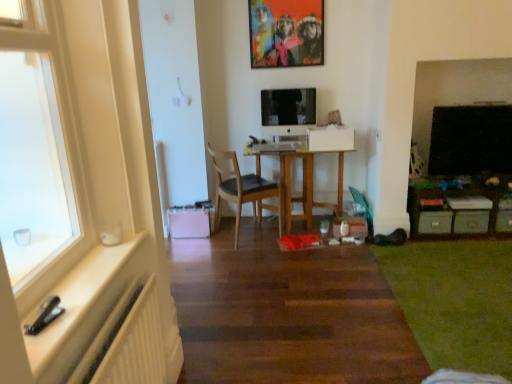
Find the location of `blank space above white ribbed radiator at lower left (from a real-world perspective)`. blank space above white ribbed radiator at lower left (from a real-world perspective) is located at coordinates (x=112, y=330).